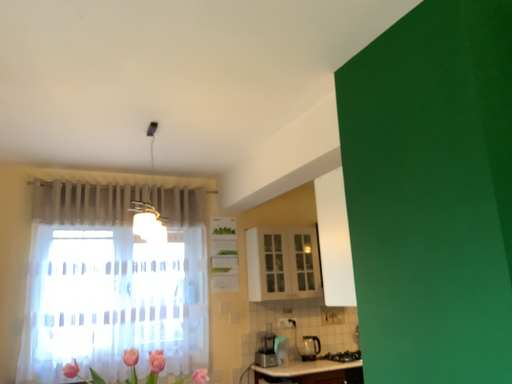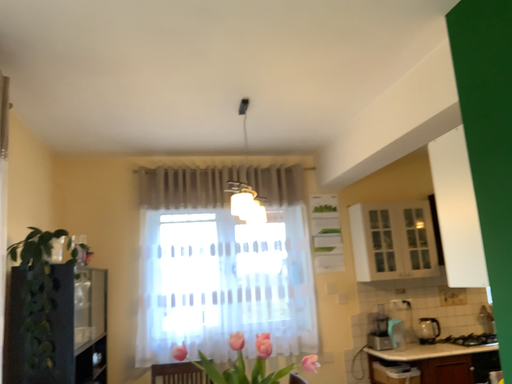
Question: Which way did the camera rotate in the video?

Choices:
 (A) rotated right
 (B) rotated left

Answer: (B)